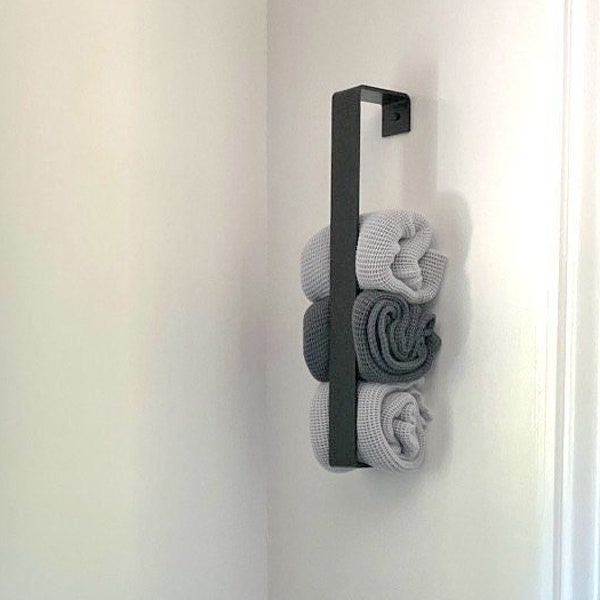
Locate an element on the screen. Image resolution: width=600 pixels, height=600 pixels. towel holder is located at coordinates (342, 132).